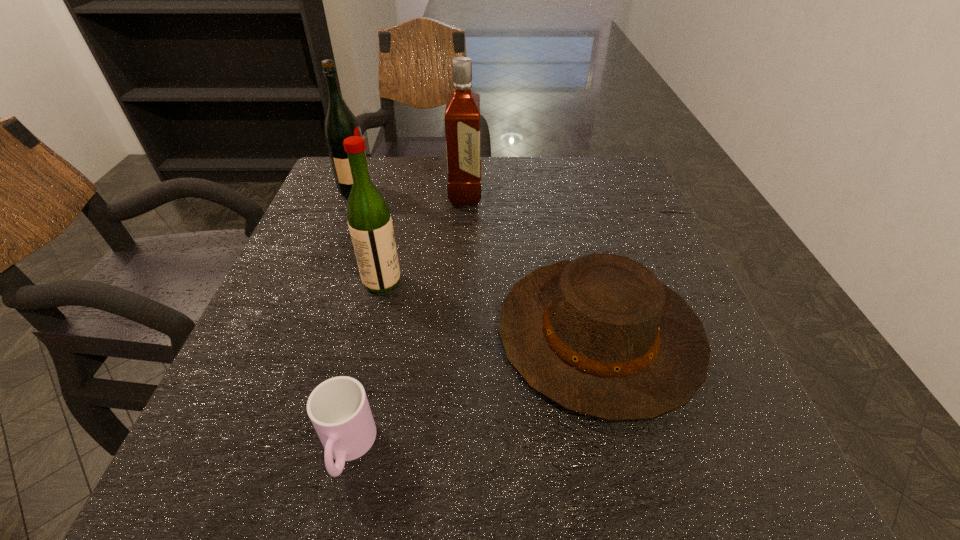
At what (x,y) coordinates should I click in order to perform the action: click on the fourth object from left to right. Please return your answer as a coordinate pair (x, y). This screenshot has height=540, width=960. Looking at the image, I should click on (462, 115).

Where is `the leftmost liquor`? the leftmost liquor is located at coordinates (340, 123).

Locate an element on the screen. The width and height of the screenshot is (960, 540). the second liquor from left to right is located at coordinates (370, 224).

The image size is (960, 540). I want to click on cowboy hat, so click(601, 336).

Where is `the second shortest object`? the second shortest object is located at coordinates (601, 336).

Locate an element on the screen. This screenshot has width=960, height=540. cup is located at coordinates (338, 408).

Where is `vacant space positioned 0.310m on the front label of the rightmost liquor`? The height and width of the screenshot is (540, 960). vacant space positioned 0.310m on the front label of the rightmost liquor is located at coordinates (604, 194).

Where is `vacant space located on the front-facing side of the leftmost object`? This screenshot has width=960, height=540. vacant space located on the front-facing side of the leftmost object is located at coordinates (457, 191).

This screenshot has height=540, width=960. I want to click on free space located on the label of the nearest liquor, so click(521, 281).

Find the location of `free space located 0.050m on the left of the fourth tallest object`. free space located 0.050m on the left of the fourth tallest object is located at coordinates (469, 335).